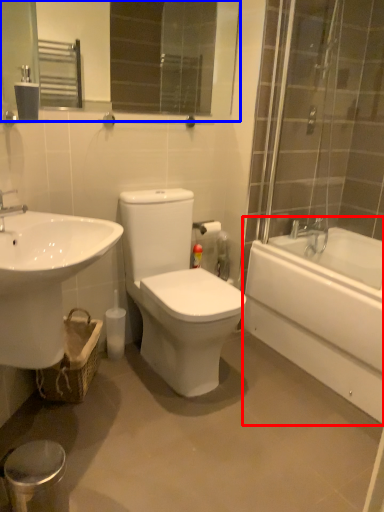
Question: Which object is closer to the camera taking this photo, bathtub (highlighted by a red box) or mirror (highlighted by a blue box)?

Choices:
 (A) bathtub
 (B) mirror

Answer: (B)